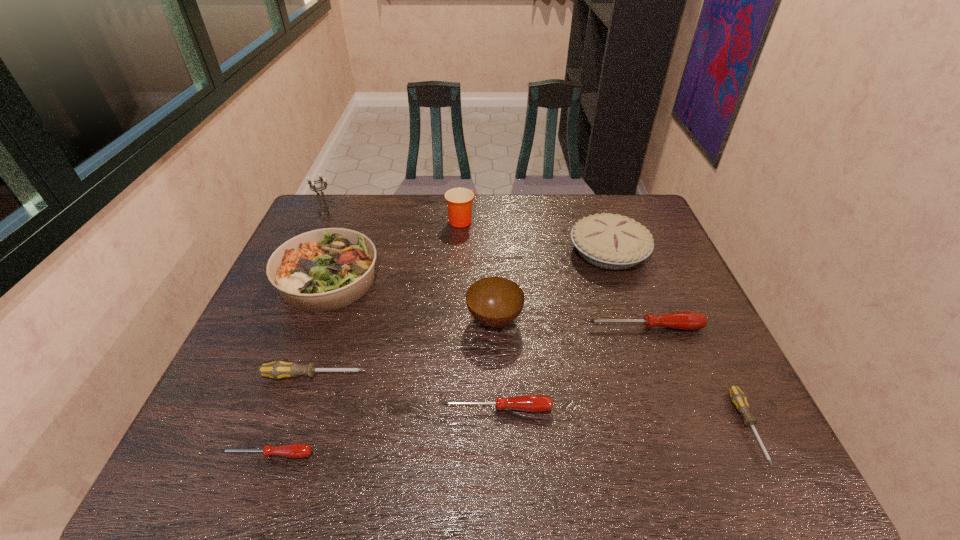
Identify the location of candle holder. Image resolution: width=960 pixels, height=540 pixels. (323, 208).

What are the coordinates of `cup` in the screenshot? It's located at (459, 200).

This screenshot has width=960, height=540. Find the location of `pie`. pie is located at coordinates (614, 242).

Locate an element on the screen. salad plate is located at coordinates (322, 270).

At what (x,y) coordinates should I click in order to perform the action: click on bowl. Please return your answer as a coordinate pair (x, y). Looking at the image, I should click on (495, 302).

This screenshot has width=960, height=540. In order to click on the farthest screwdriver in this screenshot , I will do `click(683, 320)`.

Identify the location of the farthest red screwdriver. The height and width of the screenshot is (540, 960). (683, 320).

At what (x,y) coordinates should I click in order to perform the action: click on the left gray screwdriver. Please return your answer as a coordinate pair (x, y). The height and width of the screenshot is (540, 960). Looking at the image, I should click on (279, 369).

The image size is (960, 540). In order to click on the fourth nearest object in this screenshot , I will do `click(279, 369)`.

The image size is (960, 540). In order to click on the second biggest red screwdriver in this screenshot , I will do `click(530, 403)`.